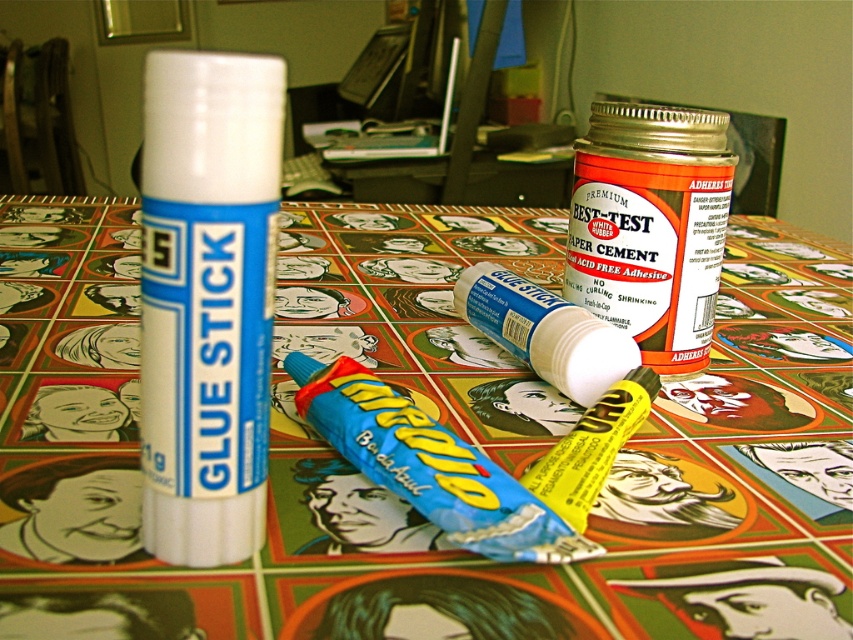
Question: Which is nearer to the blue matte glue stick at center?

Choices:
 (A) white matte glue stick at center
 (B) yellow matte lip balm at center
 (C) blue plastic tube at center
 (D) multicolored printed paper at center

Answer: (B)

Question: Does multicolored printed paper at center have a larger size compared to white matte glue stick at center?

Choices:
 (A) yes
 (B) no

Answer: (A)

Question: Which point appears farthest from the camera in this image?

Choices:
 (A) (753, 472)
 (B) (471, 449)
 (C) (148, 186)
 (D) (619, 138)

Answer: (D)

Question: Which point is closer to the camera taking this photo?

Choices:
 (A) (316, 566)
 (B) (180, 531)
 (C) (596, 342)

Answer: (B)

Question: Does multicolored printed paper at center have a larger size compared to yellow matte lip balm at center?

Choices:
 (A) yes
 (B) no

Answer: (A)

Question: Is multicolored printed paper at center to the right of yellow matte lip balm at center from the viewer's perspective?

Choices:
 (A) no
 (B) yes

Answer: (A)